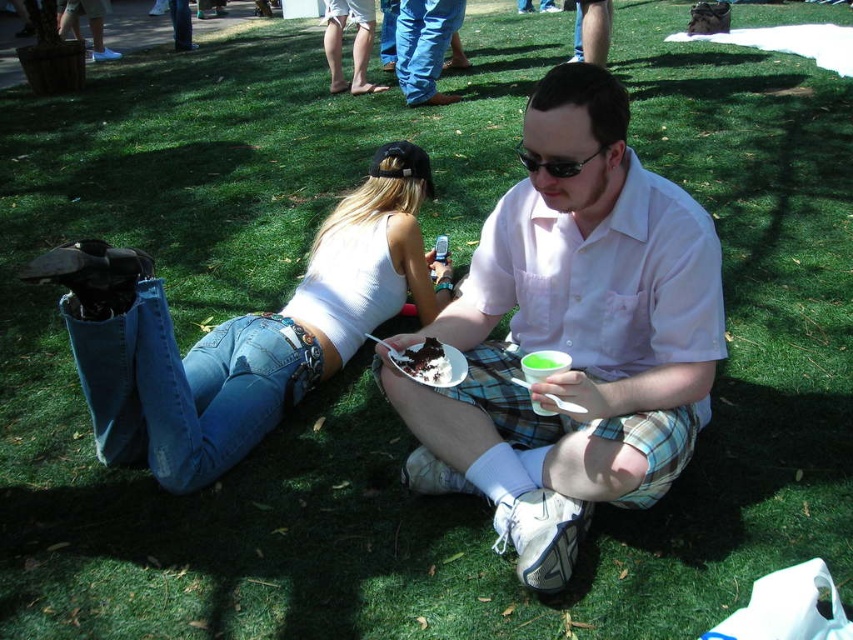
Can you confirm if denim jeans at lower left is thinner than black plastic goggles at center?

No.

Does point (115, 380) come farther from viewer compared to point (534, 163)?

Yes, point (115, 380) is farther from viewer.

This screenshot has width=853, height=640. Find the location of `denim jeans at lower left`. denim jeans at lower left is located at coordinates (248, 337).

Describe the element at coordinates (248, 337) in the screenshot. Image resolution: width=853 pixels, height=640 pixels. I see `denim jeans at lower left` at that location.

Does denim jeans at lower left have a greater width compared to chocolate cake at center?

Indeed, denim jeans at lower left has a greater width compared to chocolate cake at center.

This screenshot has width=853, height=640. Describe the element at coordinates (248, 337) in the screenshot. I see `denim jeans at lower left` at that location.

Find the location of a particular element. denim jeans at lower left is located at coordinates (248, 337).

Does white cotton shirt at center appear on the left side of black plastic goggles at center?

In fact, white cotton shirt at center is to the right of black plastic goggles at center.

Does white cotton shirt at center have a smaller size compared to black plastic goggles at center?

Incorrect, white cotton shirt at center is not smaller in size than black plastic goggles at center.

This screenshot has width=853, height=640. What are the coordinates of `white cotton shirt at center` in the screenshot? It's located at coord(572,336).